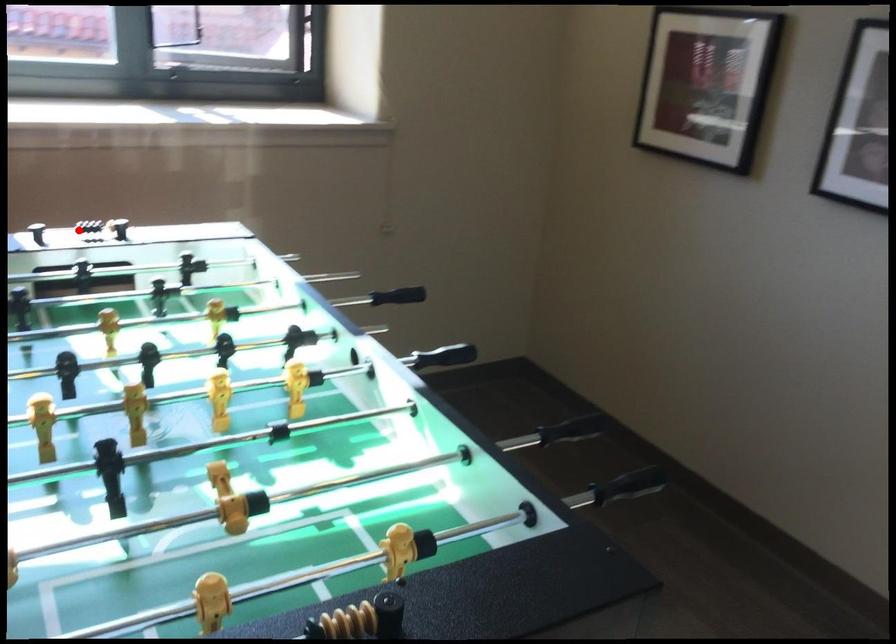
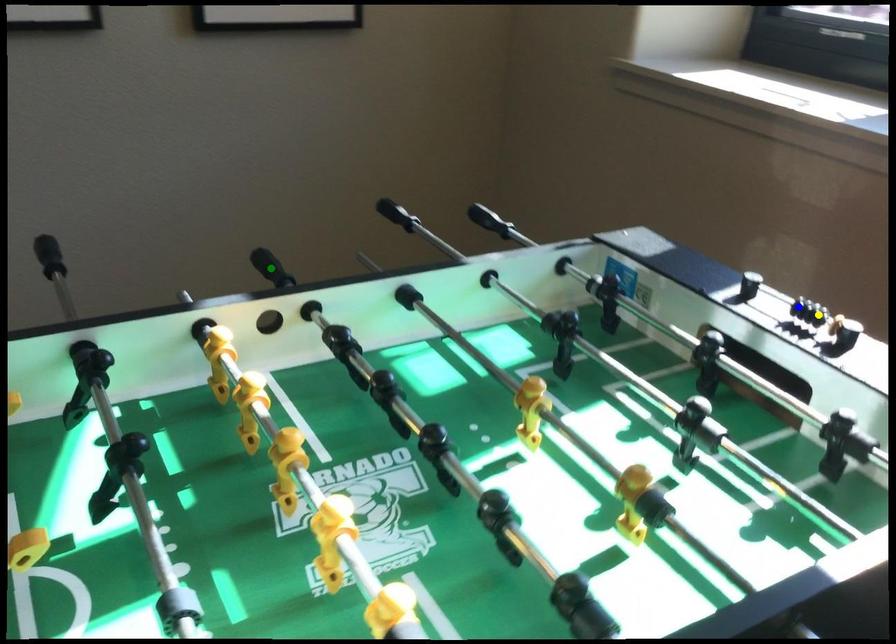
Question: I am providing you with two images of the same scene from different viewpoints. A red point is marked on the first image. You are given multiple points on the second image. In image 2, which mark is for the same physical point as the one in image 1?

Choices:
 (A) yellow point
 (B) green point
 (C) blue point

Answer: (A)